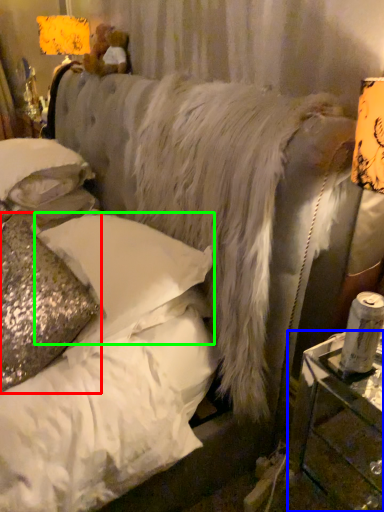
Question: Which is farther away from pillow (highlighted by a red box)? table (highlighted by a blue box) or pillow (highlighted by a green box)?

Choices:
 (A) table
 (B) pillow

Answer: (A)